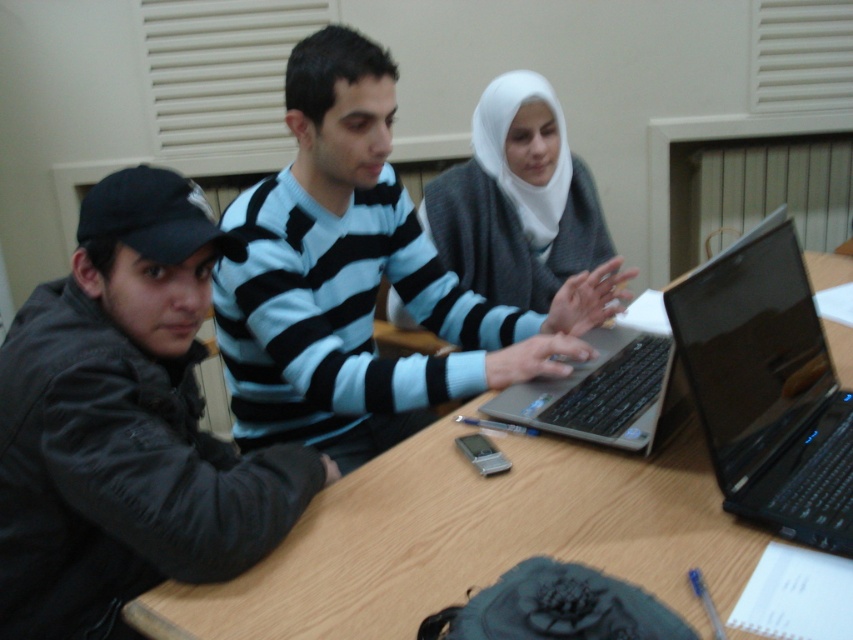
Question: Is light blue striped sweater at center wider than black glossy laptop at center?

Choices:
 (A) yes
 (B) no

Answer: (A)

Question: Which of the following is the closest to the observer?

Choices:
 (A) (289, 628)
 (B) (621, 426)
 (C) (389, 193)

Answer: (A)

Question: Among these objects, which one is nearest to the camera?

Choices:
 (A) wooden table at center
 (B) black glossy laptop at center

Answer: (A)

Question: Observing the image, what is the correct spatial positioning of dark gray jacket at left in reference to light blue striped sweater at center?

Choices:
 (A) above
 (B) below

Answer: (B)

Question: Can you confirm if light blue striped sweater at center is positioned to the left of wooden table at center?

Choices:
 (A) yes
 (B) no

Answer: (A)

Question: Which object is the farthest from the white matte hijab at center?

Choices:
 (A) black glossy laptop at center
 (B) light blue striped sweater at center

Answer: (A)